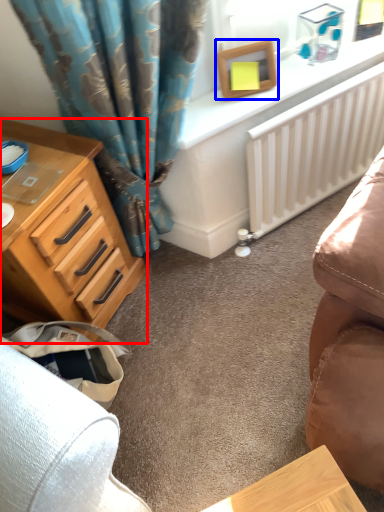
Question: Which of the following is the farthest to the observer, chest of drawers (highlighted by a red box) or picture frame (highlighted by a blue box)?

Choices:
 (A) chest of drawers
 (B) picture frame

Answer: (B)